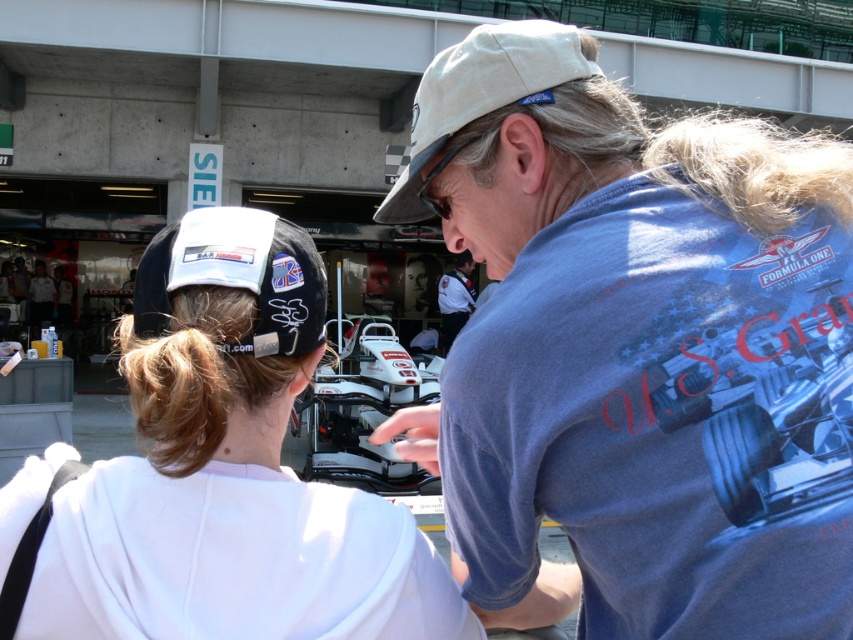
Between point (550, 605) and point (200, 218), which one is positioned in front?

Point (200, 218)

Who is positioned more to the left, white matte cap at upper center or white matte cap at upper left?

white matte cap at upper left

Is point (683, 563) closer to camera compared to point (451, 621)?

Yes, it is in front of point (451, 621).

Image resolution: width=853 pixels, height=640 pixels. Identify the location of white matte cap at upper center. (628, 346).

Can you confirm if black fabric baseball cap at upper left is positioned above white uniform at center?

Correct, black fabric baseball cap at upper left is located above white uniform at center.

Is black fabric baseball cap at upper left wider than white uniform at center?

No.

Who is more forward, (141, 282) or (450, 308)?

Point (141, 282)

Identify the location of black fabric baseball cap at upper left. (236, 275).

Is the position of white matte cap at upper center less distant than that of white uniform at center?

That is True.

This screenshot has width=853, height=640. In order to click on white matte cap at upper center in this screenshot , I will do pos(628,346).